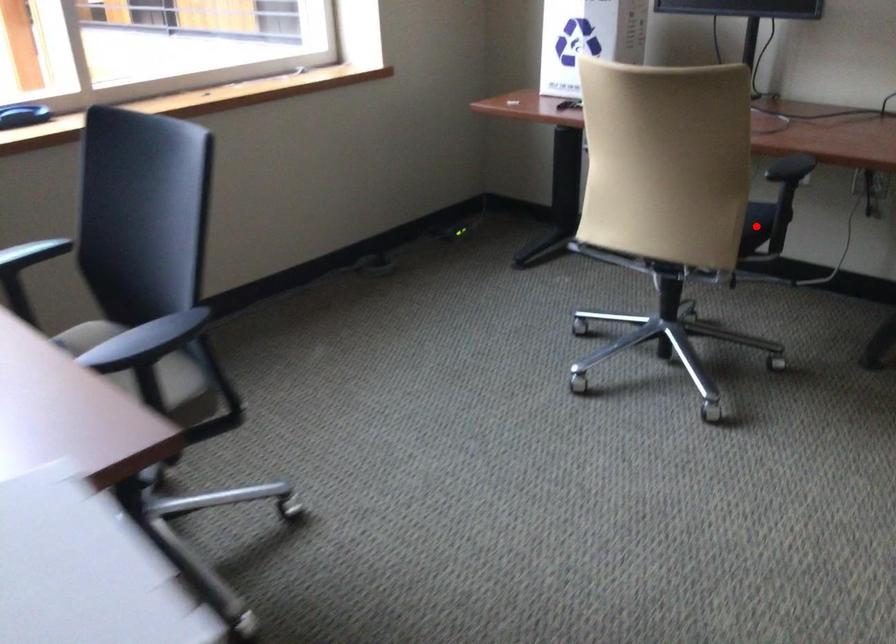
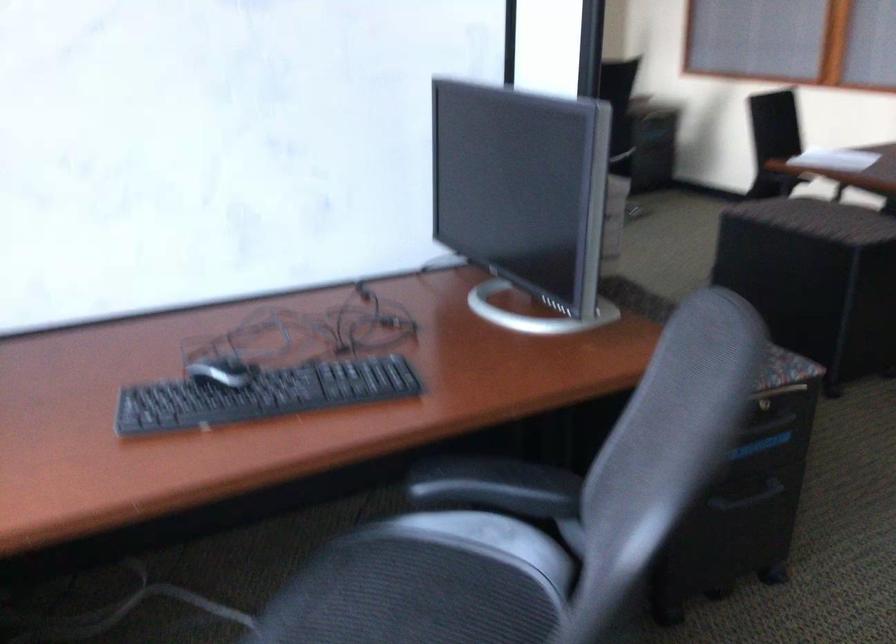
Question: I am providing you with two images of the same scene from different viewpoints. A red point is marked on the first image. Can you still see the location of the red point in image 2?

Choices:
 (A) Yes
 (B) No

Answer: (B)